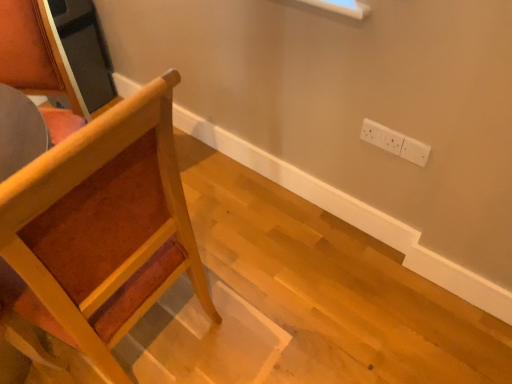
Question: Is wooden chair at left thinner than white plastic electric outlet at upper right?

Choices:
 (A) yes
 (B) no

Answer: (B)

Question: From a real-world perspective, is wooden chair at left located beneath white plastic electric outlet at upper right?

Choices:
 (A) no
 (B) yes

Answer: (A)

Question: Is wooden chair at left facing away from white plastic electric outlet at upper right?

Choices:
 (A) no
 (B) yes

Answer: (A)

Question: Does wooden chair at left come in front of white plastic electric outlet at upper right?

Choices:
 (A) yes
 (B) no

Answer: (A)

Question: Is wooden chair at left at the right side of white plastic electric outlet at upper right?

Choices:
 (A) no
 (B) yes

Answer: (A)

Question: Considering the relative positions of wooden chair at left and white plastic electric outlet at upper right in the image provided, is wooden chair at left to the left of white plastic electric outlet at upper right from the viewer's perspective?

Choices:
 (A) no
 (B) yes

Answer: (B)

Question: Is white plastic electric outlet at upper right further to camera compared to wooden chair at left?

Choices:
 (A) no
 (B) yes

Answer: (B)

Question: Is white plastic electric outlet at upper right aimed at wooden chair at left?

Choices:
 (A) yes
 (B) no

Answer: (A)

Question: Is wooden chair at left a part of white plastic electric outlet at upper right?

Choices:
 (A) yes
 (B) no

Answer: (B)

Question: Is white plastic electric outlet at upper right smaller than wooden chair at left?

Choices:
 (A) no
 (B) yes

Answer: (B)

Question: Is white plastic electric outlet at upper right bigger than wooden chair at left?

Choices:
 (A) no
 (B) yes

Answer: (A)

Question: From the image's perspective, is white plastic electric outlet at upper right located beneath wooden chair at left?

Choices:
 (A) no
 (B) yes

Answer: (A)

Question: From the image's perspective, is wooden chair at left located above or below white plastic electric outlet at upper right?

Choices:
 (A) above
 (B) below

Answer: (B)